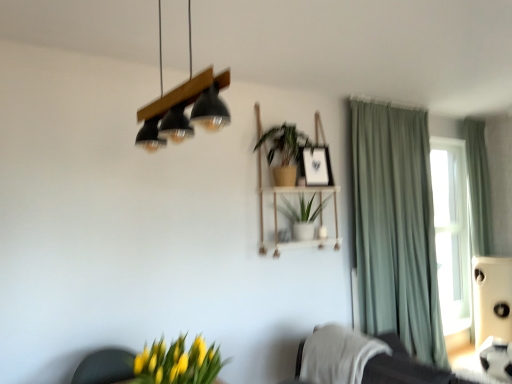
Question: Does white textured blanket at lower right have a lesser height compared to yellow-green leaves at lower left, which is counted as the third houseplant, starting from the top?

Choices:
 (A) no
 (B) yes

Answer: (A)

Question: Does white textured blanket at lower right have a greater width compared to yellow-green leaves at lower left, which appears as the 1th houseplant when ordered from the bottom?

Choices:
 (A) no
 (B) yes

Answer: (B)

Question: Does white textured blanket at lower right have a smaller size compared to yellow-green leaves at lower left, the 1th houseplant from the front?

Choices:
 (A) yes
 (B) no

Answer: (B)

Question: Could yellow-green leaves at lower left, which appears as the 3th houseplant when viewed from the back, be considered to be inside white textured blanket at lower right?

Choices:
 (A) yes
 (B) no

Answer: (B)

Question: Is white textured blanket at lower right bigger than yellow-green leaves at lower left, which is counted as the third houseplant, starting from the top?

Choices:
 (A) yes
 (B) no

Answer: (A)

Question: From the image's perspective, is white textured blanket at lower right above yellow-green leaves at lower left, which appears as the 3th houseplant when viewed from the back?

Choices:
 (A) yes
 (B) no

Answer: (B)

Question: Can you confirm if woodenblacklamp at upper center is bigger than green fabric curtain at right, placed as the 2th curtain when sorted from front to back?

Choices:
 (A) no
 (B) yes

Answer: (A)

Question: From a real-world perspective, is woodenblacklamp at upper center on green fabric curtain at right, placed as the 2th curtain when sorted from front to back?

Choices:
 (A) no
 (B) yes

Answer: (B)

Question: Can you confirm if woodenblacklamp at upper center is thinner than green fabric curtain at right, the 1th curtain positioned from the back?

Choices:
 (A) no
 (B) yes

Answer: (A)

Question: Considering the relative sizes of woodenblacklamp at upper center and green fabric curtain at right, which is counted as the second curtain, starting from the left, in the image provided, is woodenblacklamp at upper center smaller than green fabric curtain at right, which is counted as the second curtain, starting from the left,?

Choices:
 (A) yes
 (B) no

Answer: (A)

Question: Does woodenblacklamp at upper center touch green fabric curtain at right, which is counted as the second curtain, starting from the left?

Choices:
 (A) no
 (B) yes

Answer: (A)

Question: Is woodenblacklamp at upper center aimed at green fabric curtain at right, placed as the first curtain when sorted from right to left?

Choices:
 (A) yes
 (B) no

Answer: (A)

Question: From the image's perspective, is white textured blanket at lower right on green fabric curtain at right, the 1th curtain positioned from the back?

Choices:
 (A) yes
 (B) no

Answer: (B)